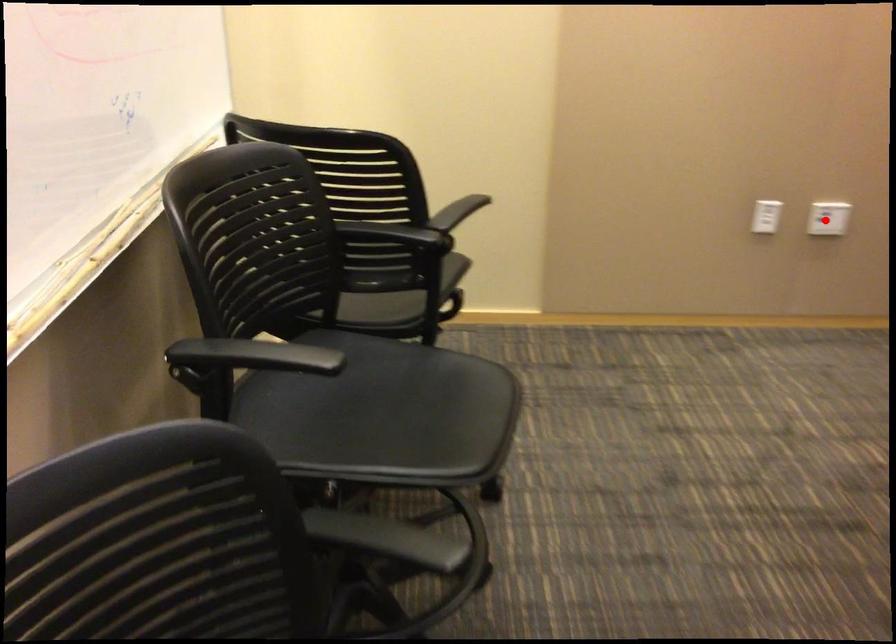
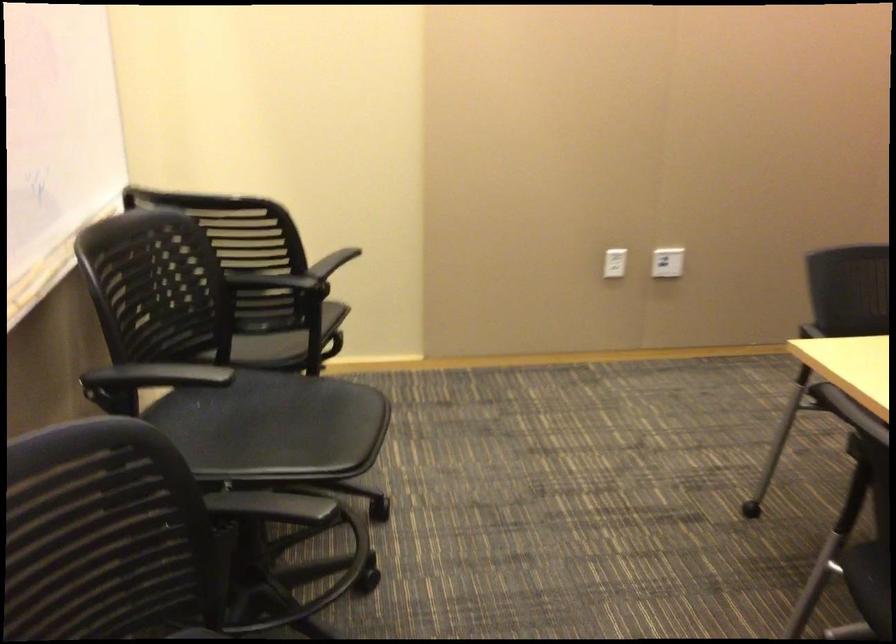
The point at the highlighted location is marked in the first image. Where is the corresponding point in the second image?

(667, 261)